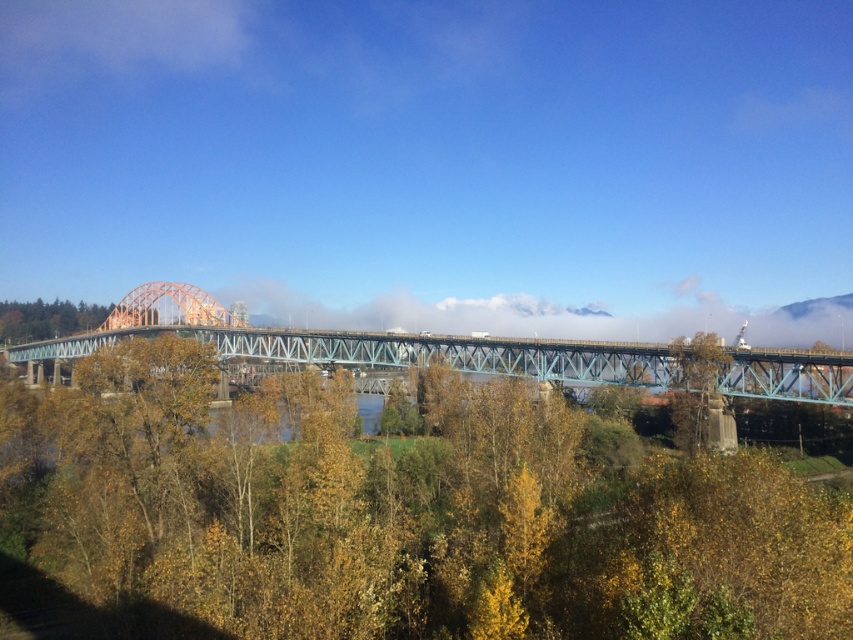
How much distance is there between yellow leafy tree at center and teal metallic bridge at center?

yellow leafy tree at center is 34.83 meters away from teal metallic bridge at center.

Does point (749, 570) come in front of point (457, 346)?

Yes, point (749, 570) is in front of point (457, 346).

Between point (485, 403) and point (378, 353), which one is positioned in front?

Positioned in front is point (485, 403).

Locate an element on the screen. The height and width of the screenshot is (640, 853). yellow leafy tree at center is located at coordinates (405, 513).